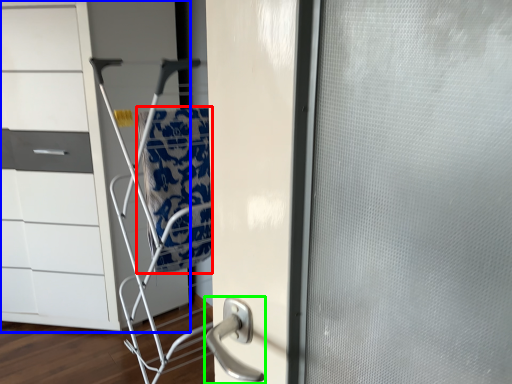
Question: Which object is the farthest from blanket (highlighted by a red box)? Choose among these: chest of drawers (highlighted by a blue box) or door handle (highlighted by a green box).

Choices:
 (A) chest of drawers
 (B) door handle

Answer: (B)